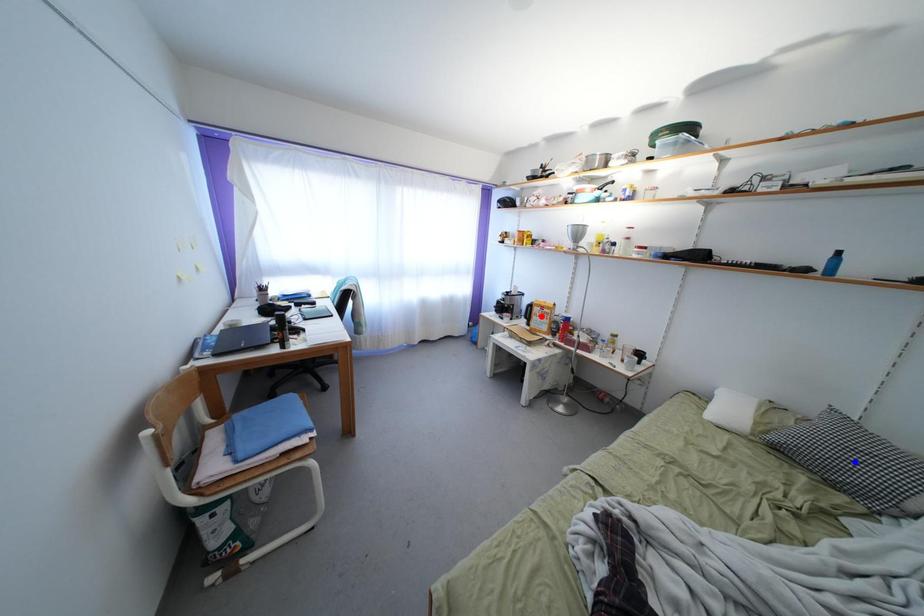
Question: In the image, two points are highlighted. Which point is nearer to the camera? Reply with the corresponding letter.

Choices:
 (A) blue point
 (B) red point

Answer: (A)